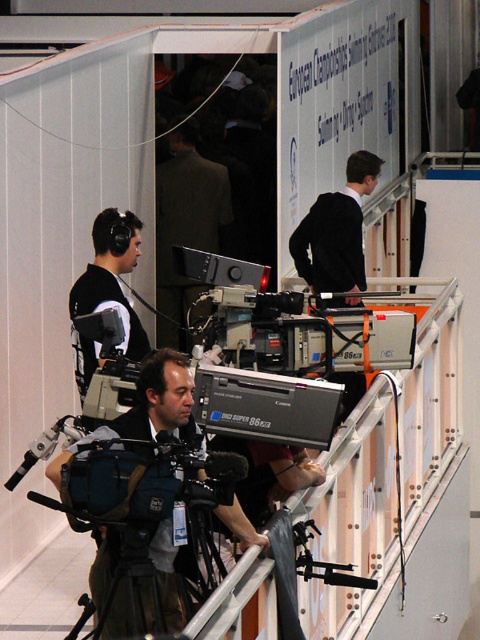
Is matte black camera at center to the left of dark gray suit at center from the viewer's perspective?

In fact, matte black camera at center is to the right of dark gray suit at center.

Between matte black camera at center and dark gray suit at center, which one is positioned lower?

Positioned lower is matte black camera at center.

You are a GUI agent. You are given a task and a screenshot of the screen. Output one action in this format:
    pyautogui.click(x=<x>, y=<y>)
    Task: Click on the matte black camera at center
    The height and width of the screenshot is (640, 480).
    Given the screenshot: What is the action you would take?
    (x=156, y=401)

Who is lower down, dark gray suit at center or black matte headphones at left?

black matte headphones at left

Can you confirm if dark gray suit at center is positioned to the left of black matte headphones at left?

Incorrect, dark gray suit at center is not on the left side of black matte headphones at left.

What do you see at coordinates (184, 225) in the screenshot?
I see `dark gray suit at center` at bounding box center [184, 225].

This screenshot has height=640, width=480. In order to click on dark gray suit at center in this screenshot , I will do `click(184, 225)`.

Does matte black camera at center have a lesser height compared to black matte headphones at left?

Correct, matte black camera at center is not as tall as black matte headphones at left.

Is matte black camera at center to the right of black matte headphones at left from the viewer's perspective?

Indeed, matte black camera at center is positioned on the right side of black matte headphones at left.

Is point (129, 616) positioned before point (93, 262)?

Yes, point (129, 616) is closer to viewer.

Locate an element on the screen. This screenshot has width=480, height=640. matte black camera at center is located at coordinates (156, 401).